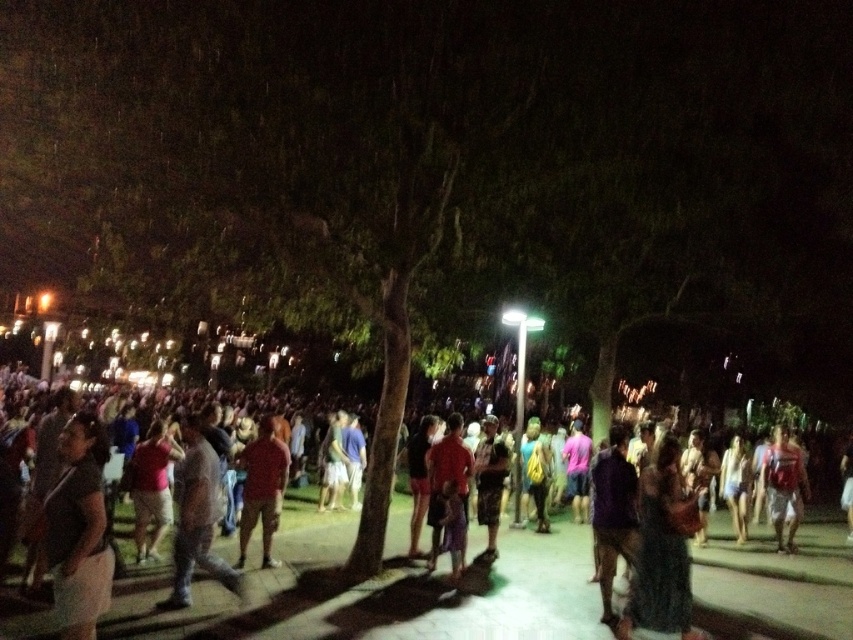
Based on the photo, is dark gray shirt at center thinner than dark gray casual pants at center?

No.

Describe the element at coordinates (380, 595) in the screenshot. I see `dark gray shirt at center` at that location.

This screenshot has width=853, height=640. I want to click on dark gray shirt at center, so click(380, 595).

How distant is dark gray casual pants at center from red fabric shirt at right?

dark gray casual pants at center is 27.27 feet away from red fabric shirt at right.

Is dark gray casual pants at center bigger than red fabric shirt at right?

Correct, dark gray casual pants at center is larger in size than red fabric shirt at right.

The image size is (853, 640). I want to click on dark gray casual pants at center, so click(x=196, y=518).

Locate an element on the screen. The width and height of the screenshot is (853, 640). dark gray casual pants at center is located at coordinates (196, 518).

Is dark gray fabric shirt at lower left further to camera compared to dark gray casual pants at center?

No, dark gray fabric shirt at lower left is in front of dark gray casual pants at center.

Which is below, dark gray fabric shirt at lower left or dark gray casual pants at center?

Positioned lower is dark gray casual pants at center.

Between point (96, 596) and point (200, 456), which one is positioned in front?

Point (96, 596)

In order to click on dark gray fabric shirt at lower left in this screenshot , I will do `click(79, 531)`.